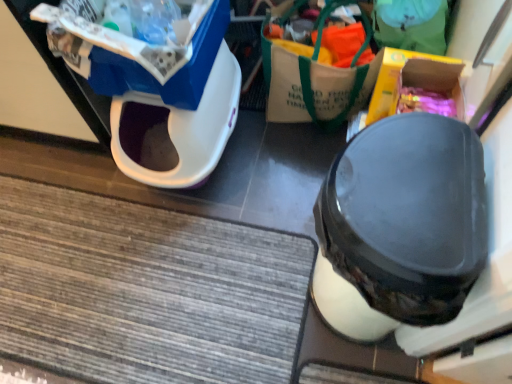
I want to click on free space above black matte shoe at center (from a real-world perspective), so click(406, 188).